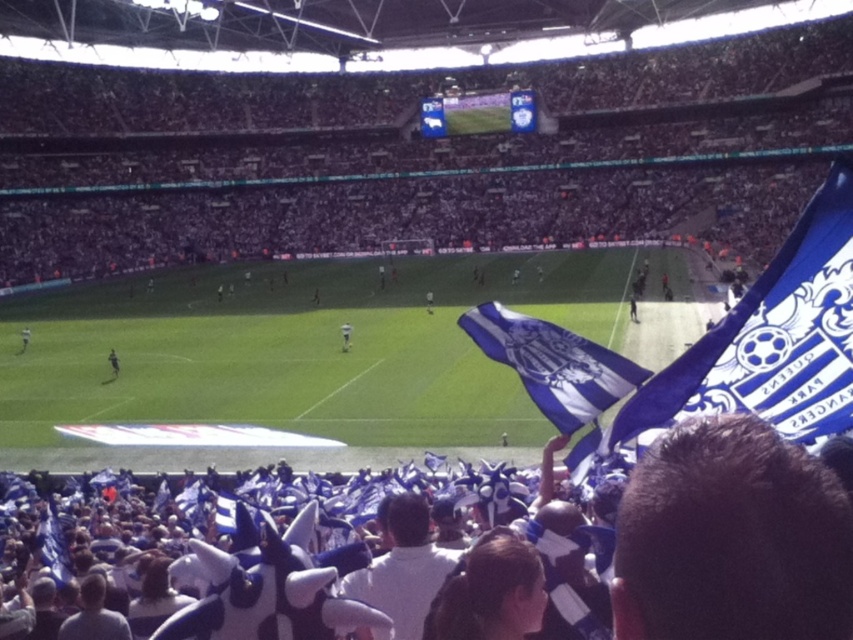
Between green grass football field at center and dark blue jersey at center, which one has less height?

With less height is dark blue jersey at center.

What are the coordinates of `green grass football field at center` in the screenshot? It's located at (306, 346).

Where is `green grass football field at center`? The image size is (853, 640). green grass football field at center is located at coordinates (306, 346).

Is white fabric hat at center in front of dark brown hair at lower right?

No, white fabric hat at center is behind dark brown hair at lower right.

What do you see at coordinates (445, 554) in the screenshot?
I see `white fabric hat at center` at bounding box center [445, 554].

Locate an element on the screen. white fabric hat at center is located at coordinates (445, 554).

Describe the element at coordinates (730, 538) in the screenshot. I see `dark brown hair at lower right` at that location.

Between dark brown hair at lower right and dark blue jersey at center, which one appears on the right side from the viewer's perspective?

Positioned to the right is dark brown hair at lower right.

The image size is (853, 640). What do you see at coordinates (730, 538) in the screenshot?
I see `dark brown hair at lower right` at bounding box center [730, 538].

I want to click on dark brown hair at lower right, so click(x=730, y=538).